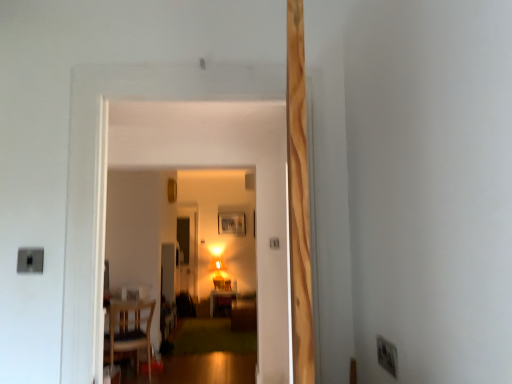
Question: From the image's perspective, is white plastic electric outlet at lower right below matte wooden table at center?

Choices:
 (A) no
 (B) yes

Answer: (A)

Question: Are white plastic electric outlet at lower right and matte wooden table at center far apart?

Choices:
 (A) yes
 (B) no

Answer: (A)

Question: Does white plastic electric outlet at lower right have a smaller size compared to matte wooden table at center?

Choices:
 (A) no
 (B) yes

Answer: (B)

Question: Can you confirm if white plastic electric outlet at lower right is positioned to the left of matte wooden table at center?

Choices:
 (A) no
 (B) yes

Answer: (A)

Question: Considering the relative positions of white plastic electric outlet at lower right and matte wooden table at center in the image provided, is white plastic electric outlet at lower right to the right of matte wooden table at center from the viewer's perspective?

Choices:
 (A) no
 (B) yes

Answer: (B)

Question: Is white plastic electric outlet at lower right not within matte wooden table at center?

Choices:
 (A) yes
 (B) no

Answer: (A)

Question: Would you say wooden picture frame at center is part of white plastic electric outlet at lower right's contents?

Choices:
 (A) no
 (B) yes

Answer: (A)

Question: Is white plastic electric outlet at lower right in contact with wooden picture frame at center?

Choices:
 (A) yes
 (B) no

Answer: (B)

Question: Is white plastic electric outlet at lower right located outside wooden picture frame at center?

Choices:
 (A) yes
 (B) no

Answer: (A)

Question: Is white plastic electric outlet at lower right not close to wooden picture frame at center?

Choices:
 (A) yes
 (B) no

Answer: (A)

Question: Considering the relative positions of white plastic electric outlet at lower right and wooden picture frame at center in the image provided, is white plastic electric outlet at lower right in front of wooden picture frame at center?

Choices:
 (A) yes
 (B) no

Answer: (A)

Question: Is white plastic electric outlet at lower right turned away from wooden picture frame at center?

Choices:
 (A) yes
 (B) no

Answer: (B)

Question: Does wooden chair at lower left have a greater height compared to matte wooden table at center?

Choices:
 (A) yes
 (B) no

Answer: (A)